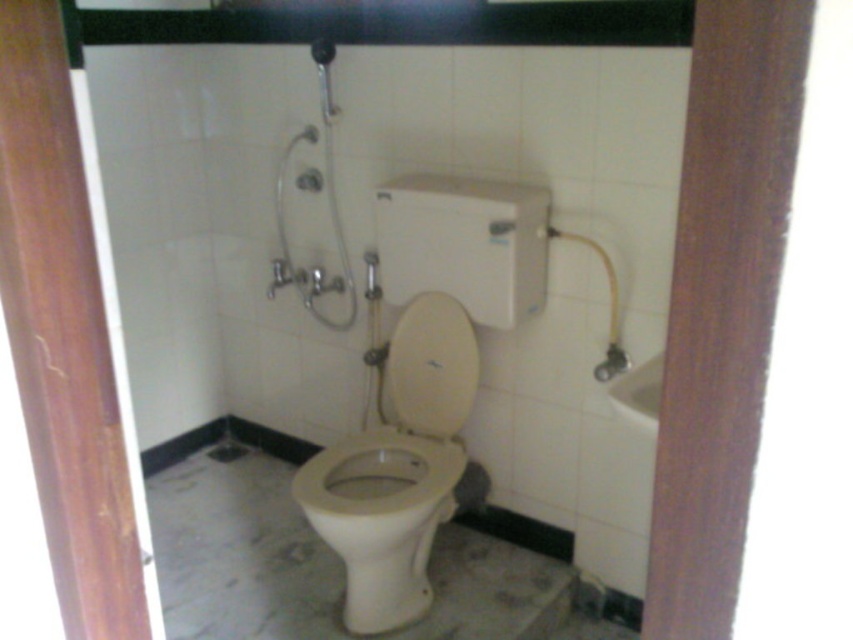
You are standing in the bathroom and need to reach the metallic silver shower at upper center to adjust its water temperature. The white glossy toilet at center is in your way. Can you step over the toilet to access the shower?

The white glossy toilet at center is below the metallic silver shower at upper center, so you can step over the toilet to reach the shower.

You are a plumber inspecting a bathroom and see the white glossy toilet bowl at center and the white glossy toilet seat at center. Which one has a bigger size?

The white glossy toilet bowl at center has a larger size compared to the white glossy toilet seat at center.